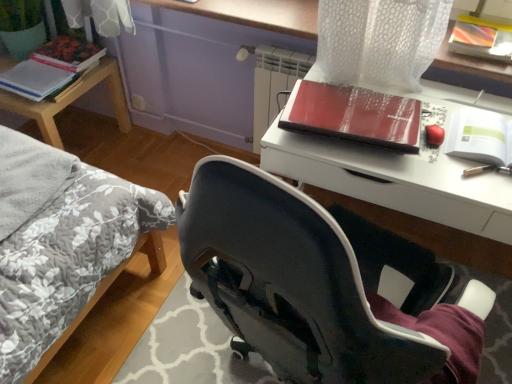
Question: Is matte paper notebook at left, acting as the 2th paperback book starting from the back, further to the viewer compared to woodenmaterial/texturetable at left?

Choices:
 (A) yes
 (B) no

Answer: (B)

Question: Considering the relative sizes of matte paper notebook at left, placed as the 2th paperback book when sorted from front to back, and woodenmaterial/texturetable at left in the image provided, is matte paper notebook at left, placed as the 2th paperback book when sorted from front to back, smaller than woodenmaterial/texturetable at left?

Choices:
 (A) yes
 (B) no

Answer: (A)

Question: Considering the relative sizes of matte paper notebook at left, the first paperback book from the left, and woodenmaterial/texturetable at left in the image provided, is matte paper notebook at left, the first paperback book from the left, taller than woodenmaterial/texturetable at left?

Choices:
 (A) no
 (B) yes

Answer: (A)

Question: Does matte paper notebook at left, marked as the 2th paperback book in a bottom-to-top arrangement, lie in front of woodenmaterial/texturetable at left?

Choices:
 (A) no
 (B) yes

Answer: (B)

Question: Are matte paper notebook at left, placed as the 2th paperback book when sorted from front to back, and woodenmaterial/texturetable at left beside each other?

Choices:
 (A) yes
 (B) no

Answer: (B)

Question: Considering the relative positions of matte paper notebook at left, placed as the 2th paperback book when sorted from front to back, and matte black desk at upper right in the image provided, is matte paper notebook at left, placed as the 2th paperback book when sorted from front to back, to the left or to the right of matte black desk at upper right?

Choices:
 (A) left
 (B) right

Answer: (A)

Question: In the image, is matte paper notebook at left, positioned as the second paperback book in top-to-bottom order, positioned in front of or behind matte black desk at upper right?

Choices:
 (A) front
 (B) behind

Answer: (B)

Question: From the image's perspective, is matte paper notebook at left, marked as the 2th paperback book in a bottom-to-top arrangement, positioned above or below matte black desk at upper right?

Choices:
 (A) above
 (B) below

Answer: (A)

Question: Considering the positions of matte paper notebook at left, placed as the 2th paperback book when sorted from front to back, and matte black desk at upper right in the image, is matte paper notebook at left, placed as the 2th paperback book when sorted from front to back, wider or thinner than matte black desk at upper right?

Choices:
 (A) thin
 (B) wide

Answer: (A)

Question: In terms of width, does green matte paperback book at upper right, the 3th paperback book positioned from the back, look wider or thinner when compared to woodenmaterial/texturetable at left?

Choices:
 (A) wide
 (B) thin

Answer: (B)

Question: From the image's perspective, relative to woodenmaterial/texturetable at left, is green matte paperback book at upper right, the first paperback book from the right, above or below?

Choices:
 (A) below
 (B) above

Answer: (A)

Question: Would you say green matte paperback book at upper right, the first paperback book from the bottom, is inside or outside woodenmaterial/texturetable at left?

Choices:
 (A) inside
 (B) outside

Answer: (B)

Question: Is green matte paperback book at upper right, the first paperback book from the bottom, taller or shorter than woodenmaterial/texturetable at left?

Choices:
 (A) short
 (B) tall

Answer: (A)

Question: From the image's perspective, relative to matte black desk at upper right, is matte hardcover book at upper left, the 2th paperback book when ordered from left to right, above or below?

Choices:
 (A) above
 (B) below

Answer: (A)

Question: From a real-world perspective, is matte hardcover book at upper left, the 1th paperback book from the back, above or below matte black desk at upper right?

Choices:
 (A) above
 (B) below

Answer: (A)